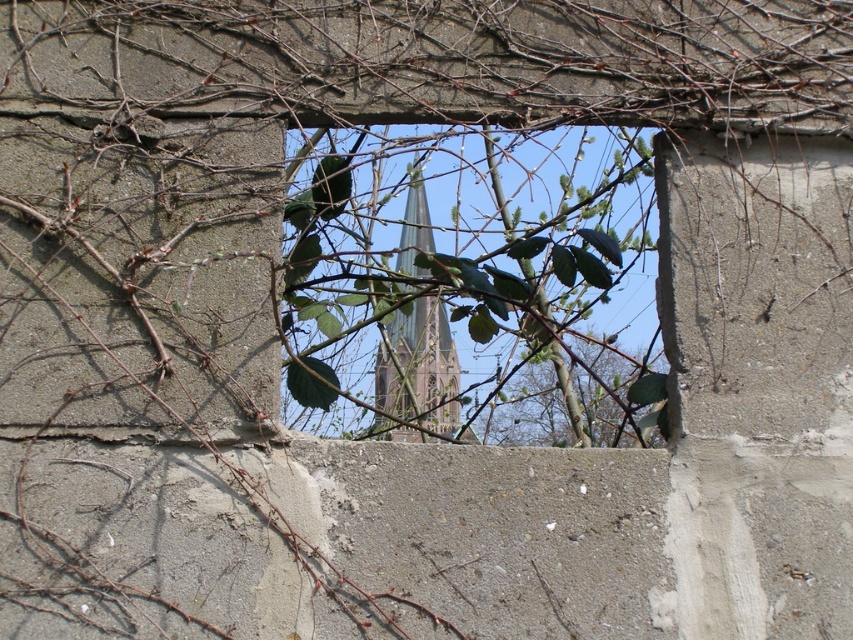
You are an artist sketching the scene. You need to decide which of the green leafy branches at center or green leafy branch at center should be drawn larger in your sketch to accurately represent the scene. Which one should you choose?

The green leafy branches at center is bigger than the green leafy branch at center, so you should draw the green leafy branches at center larger in your sketch.

You are a painter setting up an easel to capture the view of the church steeple through the green leafy branches at center and the green glass tower at center. To ensure the steeple is clearly visible in your painting, which object should you position closer to the foreground?

The green leafy branches at center should be positioned closer to the foreground since it is on the right side of the green glass tower at center, allowing the steeple to be seen through the gap between them.

You are an artist sketching the scene and want to draw the green leafy branches at center and the green leafy branch at center accurately. Which one is located to the left of the other?

The green leafy branches at center is positioned on the left side of green leafy branch at center.